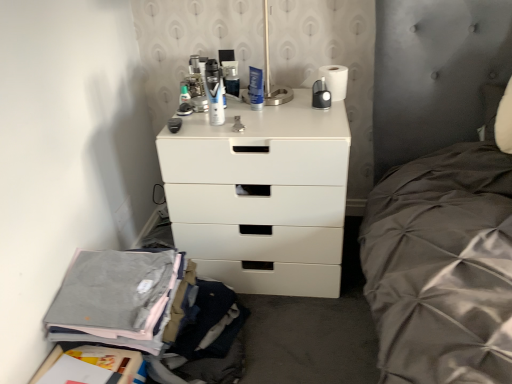
Question: Is translucent plastic toothbrush at upper center, the first toiletry positioned from the left, bigger than metallic silver can at center, which is the third toiletry from front to back?

Choices:
 (A) no
 (B) yes

Answer: (A)

Question: Is translucent plastic toothbrush at upper center, acting as the 2th toiletry starting from the back, at the right side of metallic silver can at center, which is the third toiletry from front to back?

Choices:
 (A) yes
 (B) no

Answer: (B)

Question: Is translucent plastic toothbrush at upper center, the second toiletry from the front, oriented towards metallic silver can at center, which is the third toiletry in left-to-right order?

Choices:
 (A) yes
 (B) no

Answer: (B)

Question: Is translucent plastic toothbrush at upper center, the second toiletry from the front, looking in the opposite direction of metallic silver can at center, which is the third toiletry from front to back?

Choices:
 (A) yes
 (B) no

Answer: (B)

Question: From a real-world perspective, is translucent plastic toothbrush at upper center, the second toiletry from the front, located beneath metallic silver can at center, the first toiletry from the back?

Choices:
 (A) yes
 (B) no

Answer: (A)

Question: From the image's perspective, would you say translucent plastic toothbrush at upper center, the third toiletry from the right, is positioned over metallic silver can at center, which is the third toiletry in left-to-right order?

Choices:
 (A) no
 (B) yes

Answer: (A)

Question: Does white plastic chest of drawers at center contain translucent plastic toothbrush at upper center, the second toiletry from the front?

Choices:
 (A) no
 (B) yes

Answer: (A)

Question: Is white plastic chest of drawers at center not near translucent plastic toothbrush at upper center, the third toiletry from the right?

Choices:
 (A) yes
 (B) no

Answer: (B)

Question: From the image's perspective, is white plastic chest of drawers at center above translucent plastic toothbrush at upper center, acting as the 2th toiletry starting from the back?

Choices:
 (A) yes
 (B) no

Answer: (B)

Question: Considering the relative sizes of white plastic chest of drawers at center and translucent plastic toothbrush at upper center, acting as the 2th toiletry starting from the back, in the image provided, is white plastic chest of drawers at center smaller than translucent plastic toothbrush at upper center, acting as the 2th toiletry starting from the back,?

Choices:
 (A) no
 (B) yes

Answer: (A)

Question: Does white plastic chest of drawers at center have a lesser height compared to translucent plastic toothbrush at upper center, the first toiletry positioned from the left?

Choices:
 (A) yes
 (B) no

Answer: (B)

Question: Does white plastic chest of drawers at center come in front of translucent plastic toothbrush at upper center, the second toiletry from the front?

Choices:
 (A) no
 (B) yes

Answer: (B)

Question: Is gray cotton pants at lower left at the right side of translucent plastic toothbrush at upper center, the first toiletry positioned from the left?

Choices:
 (A) yes
 (B) no

Answer: (B)